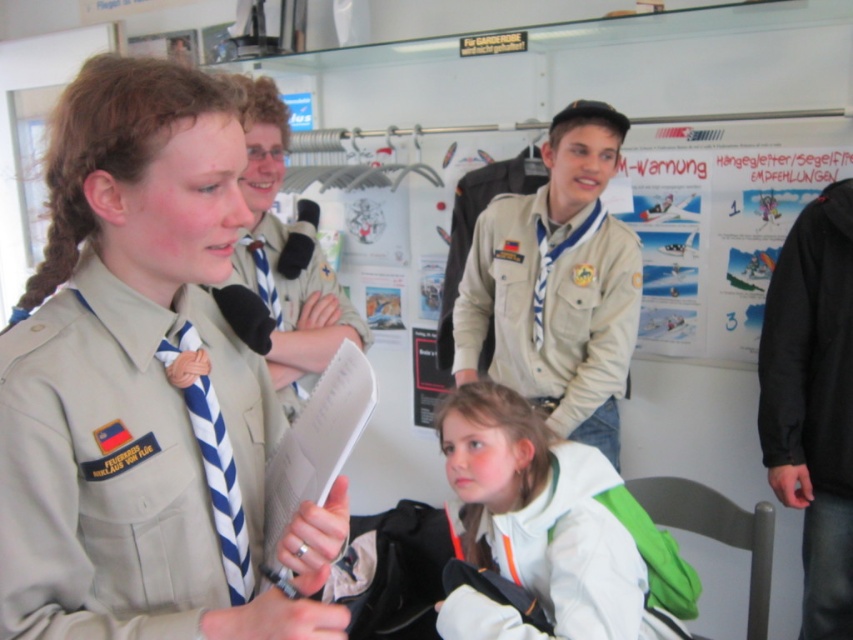
You are standing in the scout hall and see two points marked on the whiteboard. The first point is at coordinates point (4, 371) and the second point is at point (293, 506). Which point is closer to you?

Point (4, 371) is in front of point (293, 506), so the first point is closer to you.

You are a scout attending a meeting in the scout hall. You see a beige fabric uniform at center and a white paper clipboard at center. Which object is positioned higher?

The beige fabric uniform at center is located above the white paper clipboard at center, so the beige fabric uniform at center is higher.